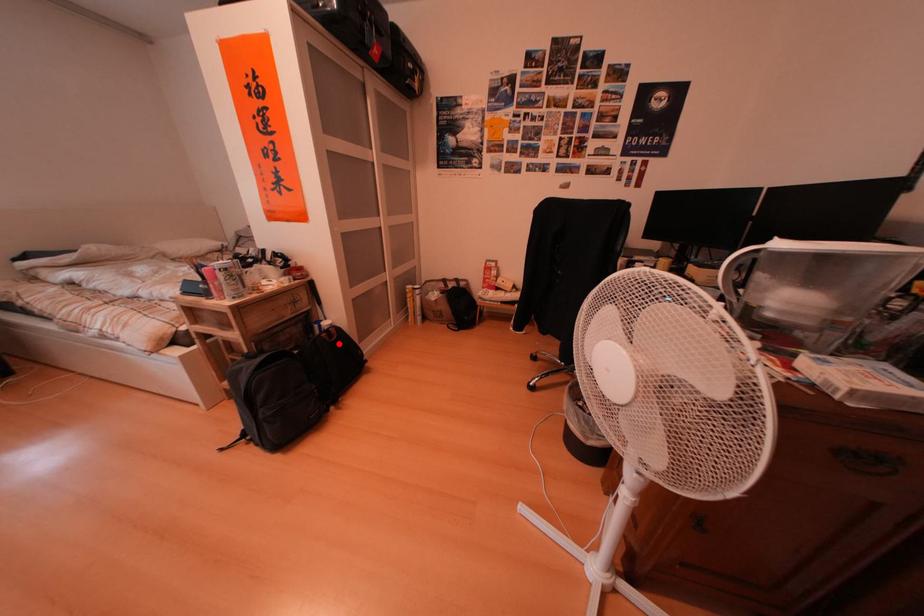
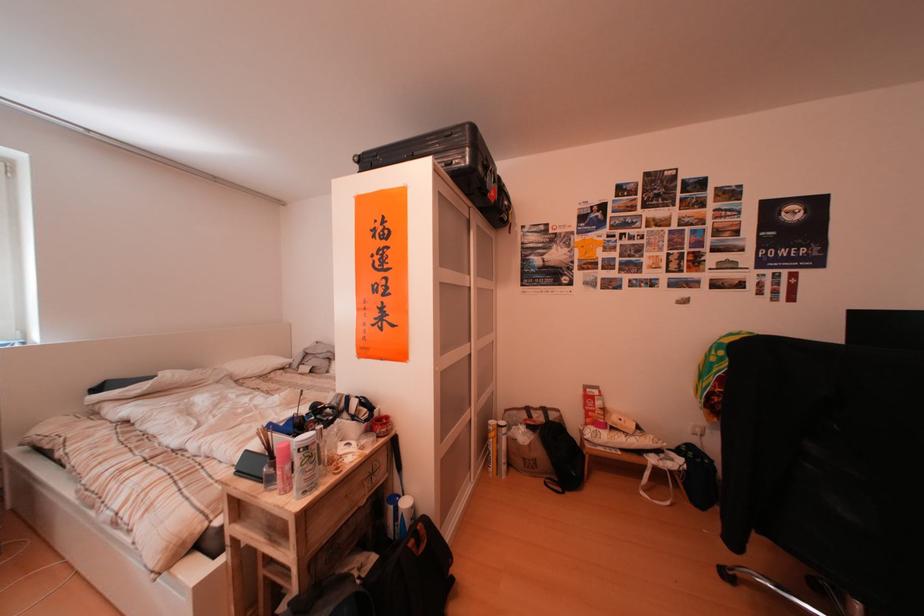
Question: I am providing you with two images of the same scene from different viewpoints. Given a red point in image1, look at the same physical point in image2. Is it:

Choices:
 (A) Closer to the viewpoint
 (B) Farther from the viewpoint

Answer: (B)